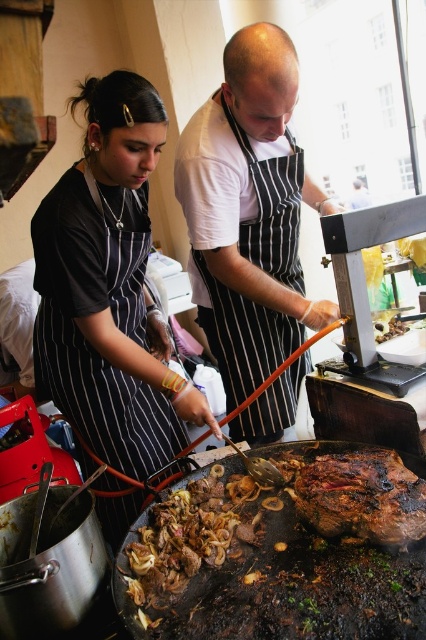
Is point (353, 483) positioned behind point (382, 474)?

No, (353, 483) is closer to viewer.

Is brown crispy meat at center closer to the viewer compared to brown charred meat at center?

Yes, brown crispy meat at center is closer to the viewer.

Is point (224, 621) positioned in front of point (423, 508)?

Yes.

At what (x,y) coordinates should I click in order to perform the action: click on brown crispy meat at center. Please return your answer as a coordinate pair (x, y). Looking at the image, I should click on (281, 552).

Is black striped apron at left wider than brown charred meat at center?

Indeed, black striped apron at left has a greater width compared to brown charred meat at center.

Is point (106, 280) positioned after point (339, 490)?

Yes.

In order to click on black striped apron at left in this screenshot , I will do `click(109, 289)`.

Does point (149, 333) come in front of point (207, 230)?

No, it is behind (207, 230).

Describe the element at coordinates (109, 289) in the screenshot. I see `black striped apron at left` at that location.

Does point (103, 404) come farther from viewer compared to point (250, 116)?

That is True.

This screenshot has width=426, height=640. In order to click on black striped apron at left in this screenshot , I will do `click(109, 289)`.